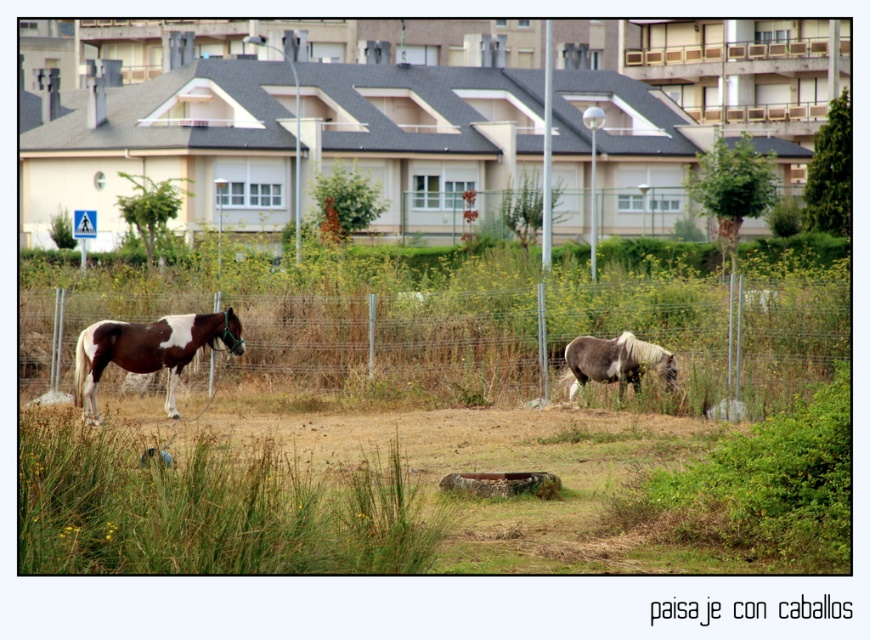
Who is positioned more to the right, wire mesh fence at center or brown and white speckled horse at left?

Positioned to the right is wire mesh fence at center.

Which is in front, point (545, 301) or point (169, 401)?

Point (169, 401) is more forward.

The width and height of the screenshot is (870, 640). I want to click on wire mesh fence at center, so click(546, 339).

Looking at this image, who is lower down, brown and white speckled horse at left or gray and white textured horse at center?

brown and white speckled horse at left is lower down.

Can you confirm if brown and white speckled horse at left is wider than gray and white textured horse at center?

Yes, brown and white speckled horse at left is wider than gray and white textured horse at center.

Who is more distant from viewer, (177, 324) or (637, 378)?

The point (637, 378) is more distant.

What are the coordinates of `brown and white speckled horse at left` in the screenshot? It's located at (148, 349).

Which of these two, wire mesh fence at center or gray and white textured horse at center, stands shorter?

With less height is gray and white textured horse at center.

Who is positioned more to the left, wire mesh fence at center or gray and white textured horse at center?

From the viewer's perspective, wire mesh fence at center appears more on the left side.

Which is in front, point (677, 296) or point (626, 353)?

Point (626, 353)

The width and height of the screenshot is (870, 640). I want to click on wire mesh fence at center, so click(546, 339).